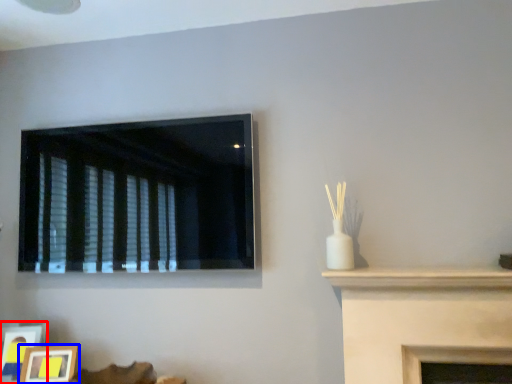
Question: Which of the following is the farthest to the observer, picture frame (highlighted by a red box) or picture frame (highlighted by a blue box)?

Choices:
 (A) picture frame
 (B) picture frame

Answer: (A)